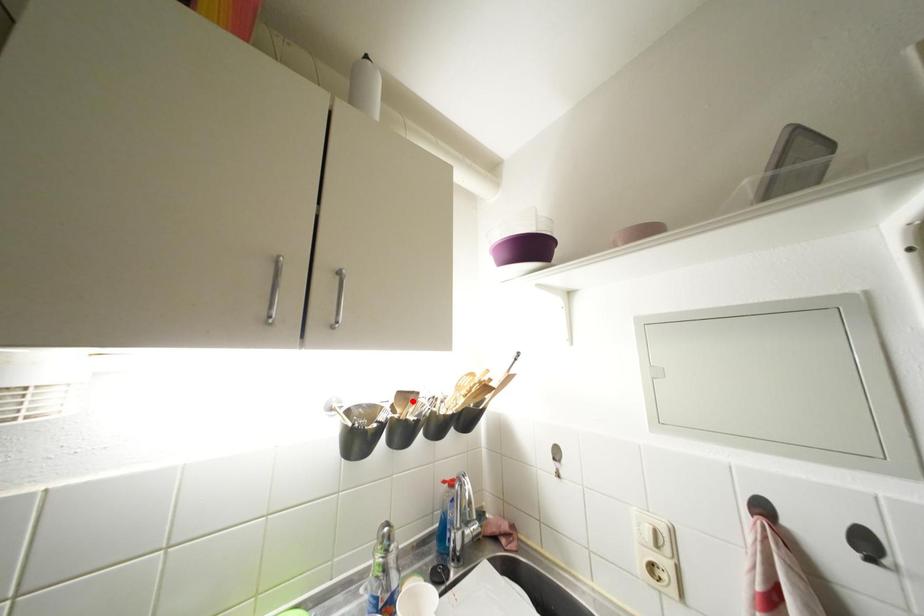
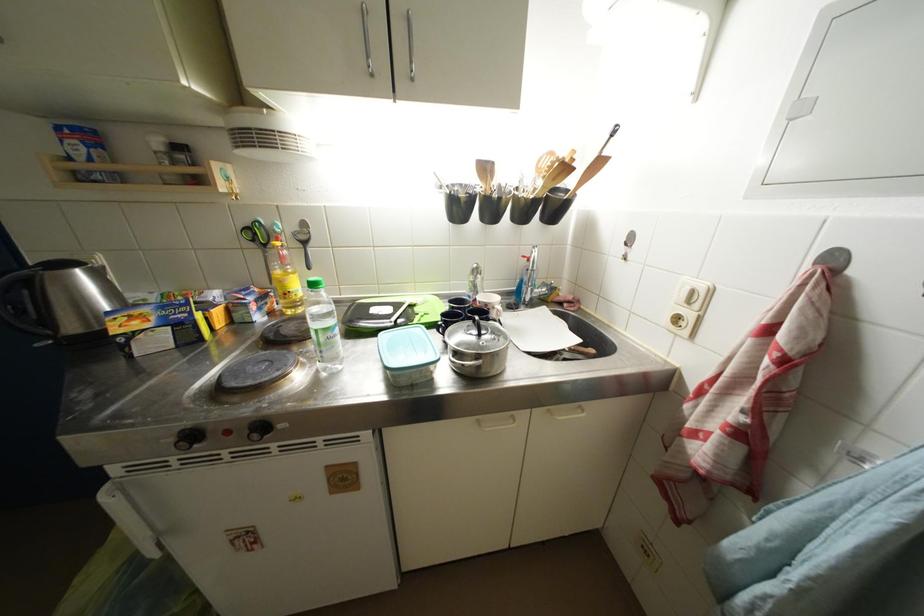
Find the pixel in the second image that matches the highlighted location in the first image.

(492, 172)